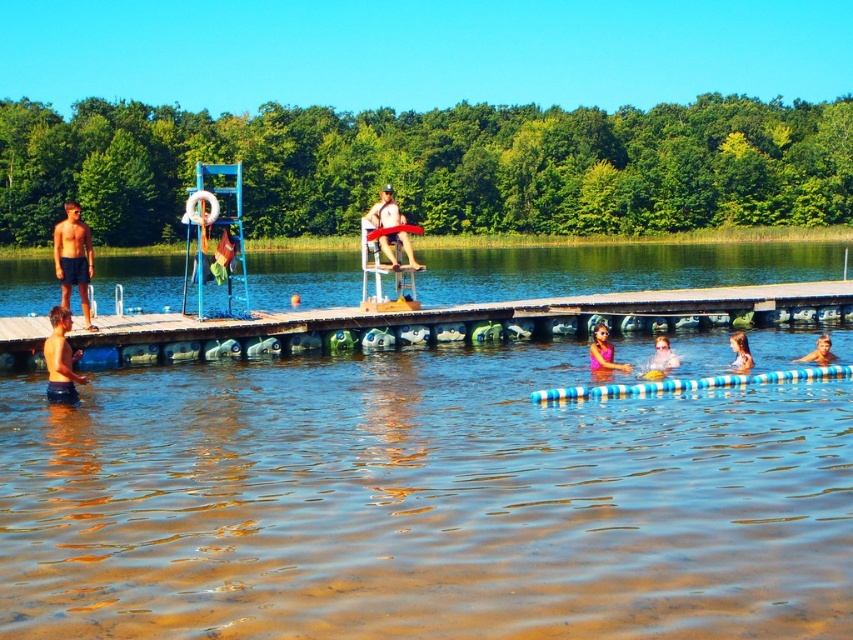
Question: Can you confirm if smooth tan lifeguard at center is positioned to the left of smooth brown wooden board at lower right?

Choices:
 (A) no
 (B) yes

Answer: (B)

Question: Which point is farther to the camera?

Choices:
 (A) (67, 289)
 (B) (59, 342)

Answer: (A)

Question: Does black matte shorts at left have a greater width compared to smooth blue swim ring at lower right?

Choices:
 (A) no
 (B) yes

Answer: (B)

Question: Which object is farther from the camera taking this photo?

Choices:
 (A) smooth tan lifeguard at center
 (B) smooth blue swim ring at lower right

Answer: (A)

Question: Which of the following is the closest to the observer?

Choices:
 (A) clear plastic pool at center
 (B) pink matte swimsuit at lower center
 (C) smooth tan lifeguard at center

Answer: (A)

Question: Is smooth tan lifeguard at center wider than pink fabric at lower center?

Choices:
 (A) no
 (B) yes

Answer: (B)